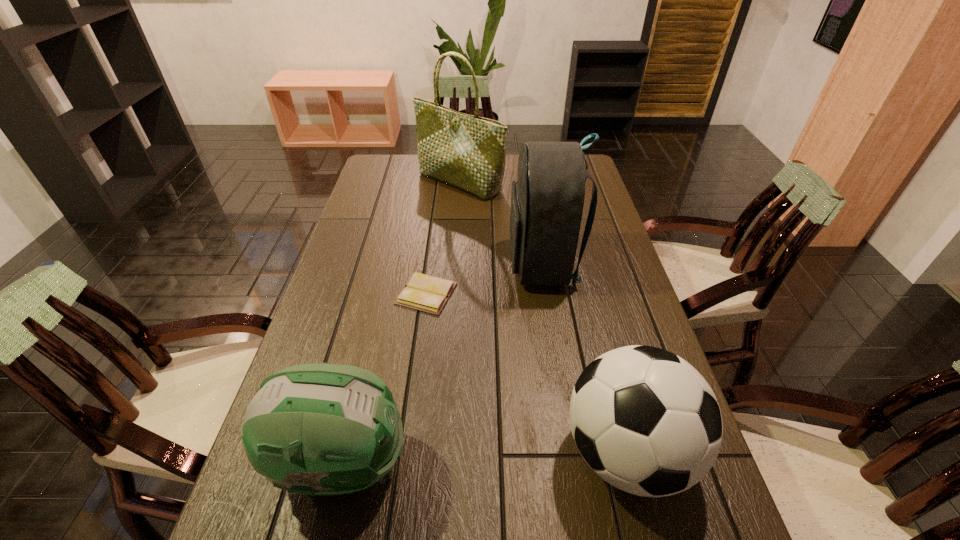
Image resolution: width=960 pixels, height=540 pixels. What are the coordinates of `the farthest object` in the screenshot? It's located at (468, 152).

The width and height of the screenshot is (960, 540). I want to click on backpack, so click(547, 201).

What are the coordinates of `soccer ball` in the screenshot? It's located at (646, 421).

At what (x,y) coordinates should I click in order to perform the action: click on football helmet. Please return your answer as a coordinate pair (x, y). Image resolution: width=960 pixels, height=540 pixels. Looking at the image, I should click on (312, 429).

Locate an element on the screen. The image size is (960, 540). the shortest object is located at coordinates (423, 292).

This screenshot has height=540, width=960. Identify the location of vacant region located 0.360m on the front of the shopping bag. (454, 266).

You are a GUI agent. You are given a task and a screenshot of the screen. Output one action in this format:
    pyautogui.click(x=<x>, y=<y>)
    Task: Click on the vacant space located 0.370m on the front-facing side of the backpack
    The image size is (960, 540).
    Given the screenshot: What is the action you would take?
    pyautogui.click(x=387, y=264)

Identify the location of vacant space located on the front-facing side of the backpack. This screenshot has height=540, width=960. pyautogui.click(x=433, y=264).

Locate an element on the screen. vacant area located 0.190m on the front-facing side of the backpack is located at coordinates (445, 264).

You are a GUI agent. You are given a task and a screenshot of the screen. Output one action in this format:
    pyautogui.click(x=<x>, y=<y>)
    Task: Click on the free location located on the back of the soccer ball
    This screenshot has height=540, width=960.
    Given the screenshot: What is the action you would take?
    pyautogui.click(x=591, y=313)